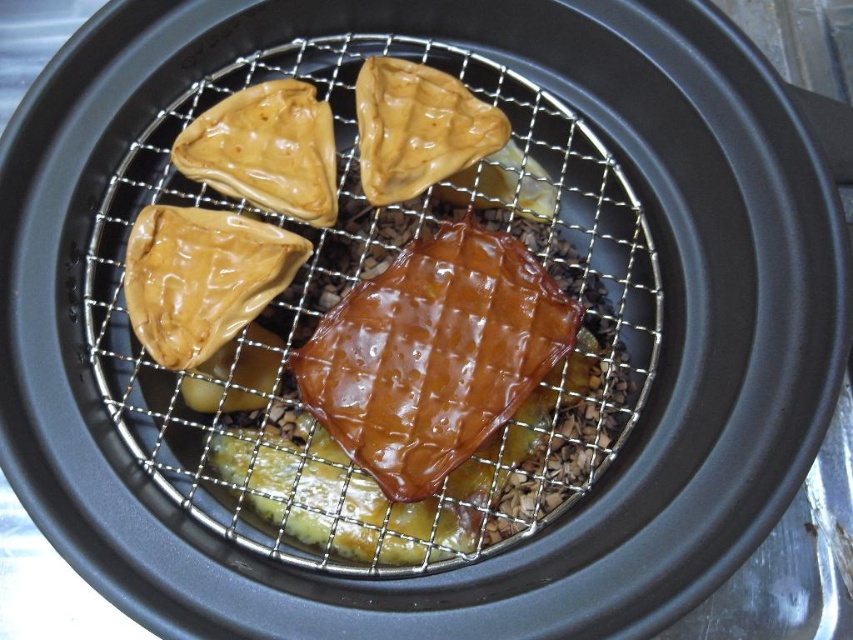
Question: Considering the relative positions of shiny brown waffle at center and glossy brown pastry at upper left in the image provided, where is shiny brown waffle at center located with respect to glossy brown pastry at upper left?

Choices:
 (A) right
 (B) left

Answer: (A)

Question: In this image, where is shiny brown meat at center located relative to glossy brown pastry at center?

Choices:
 (A) below
 (B) above

Answer: (A)

Question: Estimate the real-world distances between objects in this image. Which object is farther from the shiny brown meat at center?

Choices:
 (A) glossy brown pastry at upper left
 (B) shiny brown pastry at upper center

Answer: (A)

Question: Which of the following is the farthest from the observer?

Choices:
 (A) (463, 234)
 (B) (221, 188)

Answer: (B)

Question: Does glossy brown pastry at upper left appear under shiny brown pastry at upper center?

Choices:
 (A) yes
 (B) no

Answer: (A)

Question: Which point is closer to the camera taking this photo?

Choices:
 (A) (199, 316)
 (B) (422, 92)
 (C) (277, 134)
 (D) (354, 304)

Answer: (A)